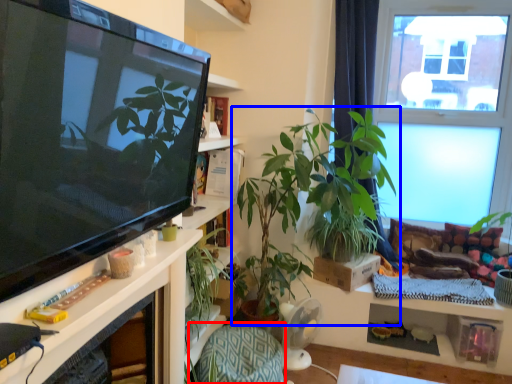
Question: Among these objects, which one is nearest to the camera, armchair (highlighted by a red box) or houseplant (highlighted by a blue box)?

Choices:
 (A) armchair
 (B) houseplant

Answer: (B)